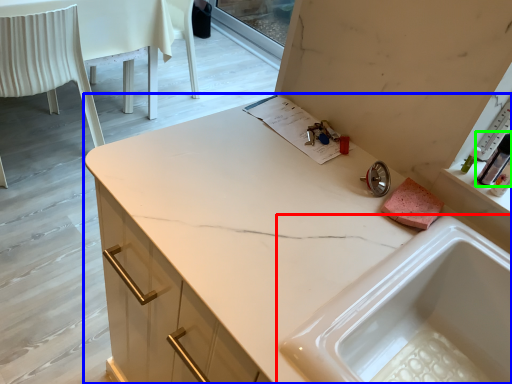
Question: Which object is positioned farthest from sink (highlighted by a red box)? Select from countertop (highlighted by a blue box) and toiletry (highlighted by a green box).

Choices:
 (A) countertop
 (B) toiletry

Answer: (B)